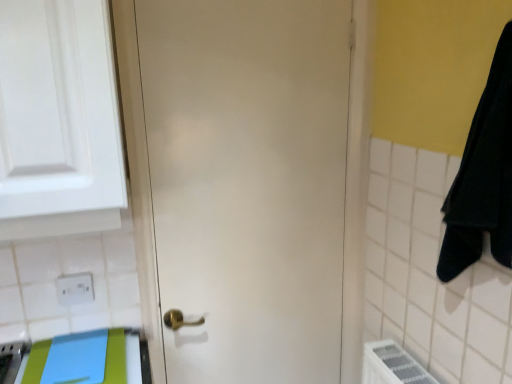
Question: Looking at the image, does white plastic electric outlet at lower left seem bigger or smaller compared to white glossy cabinet at upper left?

Choices:
 (A) small
 (B) big

Answer: (A)

Question: From the image's perspective, is white plastic electric outlet at lower left located above or below white glossy cabinet at upper left?

Choices:
 (A) above
 (B) below

Answer: (B)

Question: Estimate the real-world distances between objects in this image. Which object is farther from the white plastic electric outlet at lower left?

Choices:
 (A) blue fabric beach towel at lower left
 (B) white glossy cabinet at upper left
 (C) white matte door at center

Answer: (C)

Question: Estimate the real-world distances between objects in this image. Which object is closer to the white matte door at center?

Choices:
 (A) blue fabric beach towel at lower left
 (B) white glossy cabinet at upper left
 (C) white plastic electric outlet at lower left

Answer: (B)